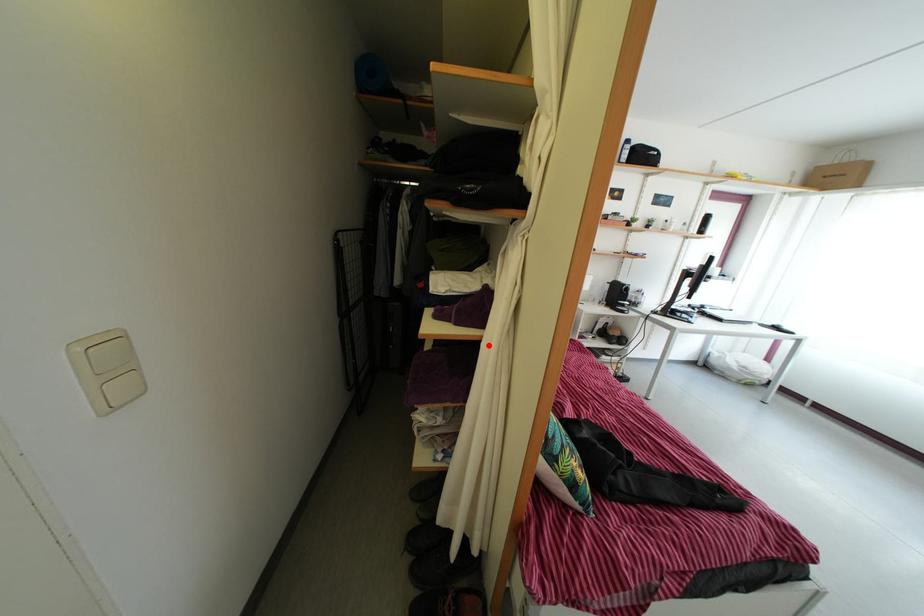
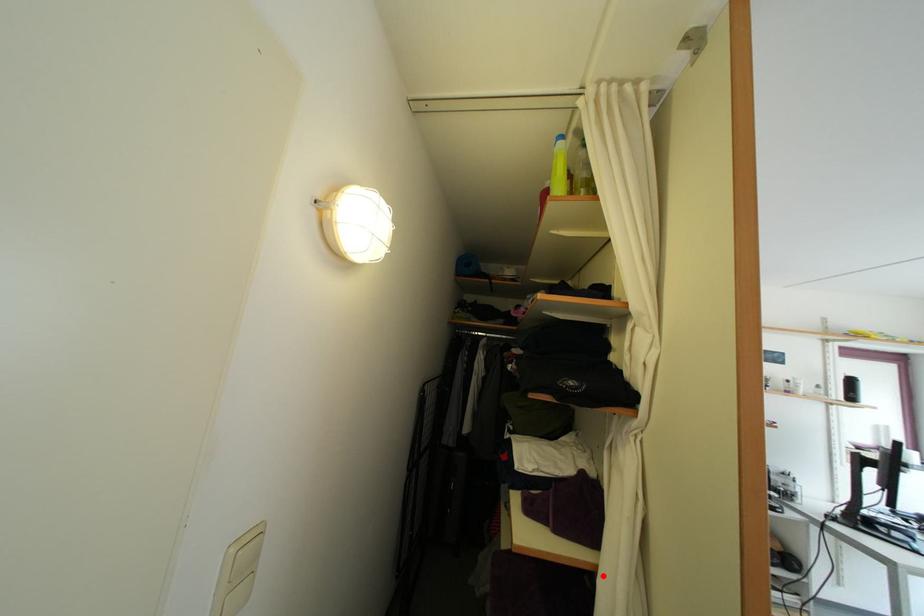
I am providing you with two images of the same scene from different viewpoints. A red point is marked on the first image and another point is marked on the second image. Is the red point in image1 aligned with the point shown in image2?

Yes